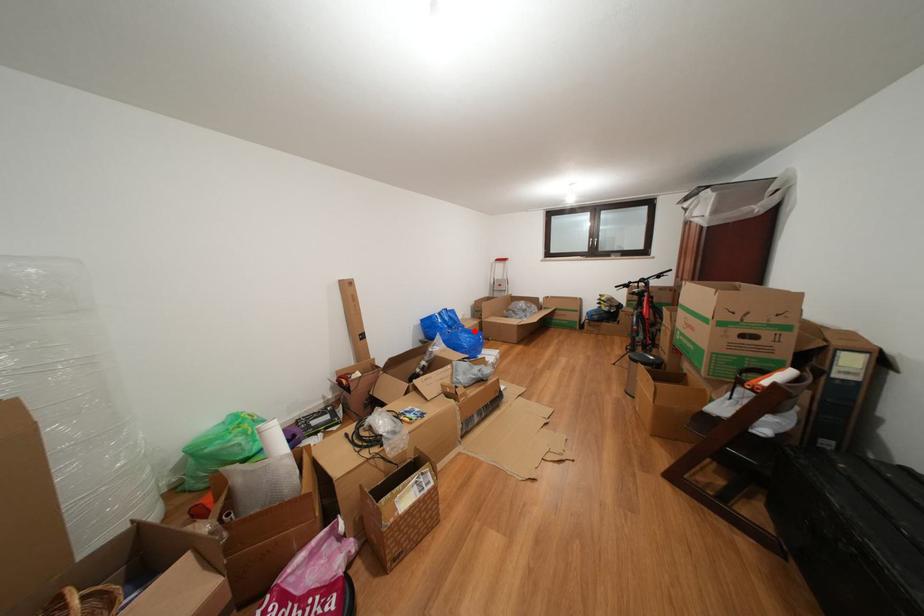
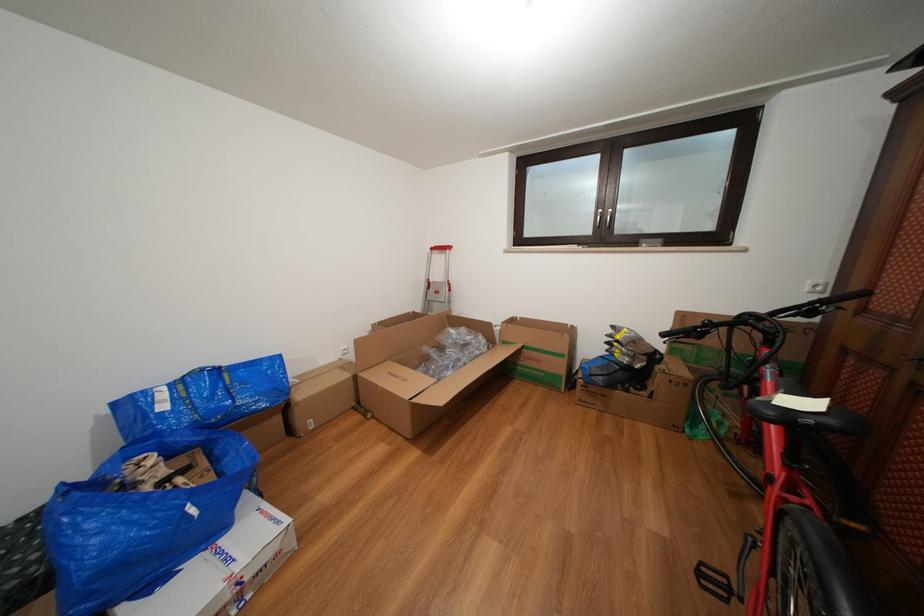
Locate, in the second image, the point that corresponds to the highlighted location in the first image.

(309, 400)